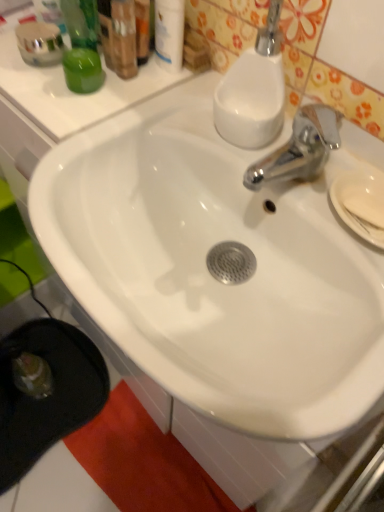
Where is `white glossy lotion at upper center`? This screenshot has width=384, height=512. white glossy lotion at upper center is located at coordinates (169, 34).

The width and height of the screenshot is (384, 512). What do you see at coordinates (83, 70) in the screenshot? I see `green matte jar at upper left` at bounding box center [83, 70].

I want to click on white glossy lotion at upper center, so click(169, 34).

Is red cotton beach towel at lower left beside white glossy soap dispenser at upper right?

They are not placed beside each other.

In terms of height, does red cotton beach towel at lower left look taller or shorter compared to white glossy soap dispenser at upper right?

In the image, red cotton beach towel at lower left appears to be shorter than white glossy soap dispenser at upper right.

Considering the sizes of red cotton beach towel at lower left and white glossy soap dispenser at upper right in the image, is red cotton beach towel at lower left wider or thinner than white glossy soap dispenser at upper right?

red cotton beach towel at lower left is wider than white glossy soap dispenser at upper right.

Find the location of `soap dispenser above the green matte jar at upper left (from a real-world perspective)`. soap dispenser above the green matte jar at upper left (from a real-world perspective) is located at coordinates (253, 90).

Is white glossy soap dispenser at upper right oriented towards green matte jar at upper left?

No, white glossy soap dispenser at upper right is not turned towards green matte jar at upper left.

In the image, is white glossy soap dispenser at upper right on the left side or the right side of green matte jar at upper left?

Based on their positions, white glossy soap dispenser at upper right is located to the right of green matte jar at upper left.

Based on the photo, which is less distant, (x=242, y=88) or (x=97, y=74)?

Point (x=242, y=88).

Is red cotton beach towel at lower left facing towards white glossy sink at center?

No, red cotton beach towel at lower left does not turn towards white glossy sink at center.

Does red cotton beach towel at lower left have a lesser width compared to white glossy sink at center?

Yes, red cotton beach towel at lower left is thinner than white glossy sink at center.

Considering the positions of objects red cotton beach towel at lower left and white glossy sink at center in the image provided, who is more to the right, red cotton beach towel at lower left or white glossy sink at center?

white glossy sink at center is more to the right.

Does white matte soap at right have a lesser width compared to red cotton beach towel at lower left?

Yes.

Is white matte soap at right next to red cotton beach towel at lower left and touching it?

No, white matte soap at right is not beside red cotton beach towel at lower left.

Consider the image. What's the angular difference between white matte soap at right and red cotton beach towel at lower left's facing directions?

The facing directions of white matte soap at right and red cotton beach towel at lower left are 3.73 degrees apart.

Is point (354, 208) farther from camera compared to point (162, 455)?

No, (354, 208) is closer to viewer.

Considering the sizes of objects white glossy sink at center and white glossy soap dispenser at upper right in the image provided, who is wider, white glossy sink at center or white glossy soap dispenser at upper right?

Wider between the two is white glossy sink at center.

Consider the image. In terms of height, does white glossy sink at center look taller or shorter compared to white glossy soap dispenser at upper right?

Considering their sizes, white glossy sink at center has more height than white glossy soap dispenser at upper right.

From a real-world perspective, is white glossy sink at center on white glossy soap dispenser at upper right?

No.

How different are the orientations of white glossy lotion at upper center and white matte soap at right in degrees?

The facing directions of white glossy lotion at upper center and white matte soap at right are 8.45 degrees apart.

From the image's perspective, which is below, white glossy lotion at upper center or white matte soap at right?

white matte soap at right, from the image's perspective.

Considering the relative positions of white glossy lotion at upper center and white matte soap at right in the image provided, is white glossy lotion at upper center in front of white matte soap at right?

No, white glossy lotion at upper center is further to the viewer.

Considering the relative sizes of white glossy lotion at upper center and red cotton beach towel at lower left in the image provided, is white glossy lotion at upper center wider than red cotton beach towel at lower left?

Incorrect, the width of white glossy lotion at upper center does not surpass that of red cotton beach towel at lower left.

Considering the sizes of objects white glossy lotion at upper center and red cotton beach towel at lower left in the image provided, who is bigger, white glossy lotion at upper center or red cotton beach towel at lower left?

red cotton beach towel at lower left is bigger.

Is white glossy lotion at upper center facing away from red cotton beach towel at lower left?

white glossy lotion at upper center is not turned away from red cotton beach towel at lower left.

Locate an element on the screen. beach towel below the white glossy lotion at upper center (from a real-world perspective) is located at coordinates (143, 462).

The image size is (384, 512). In order to click on soap dispenser above the red cotton beach towel at lower left (from a real-world perspective) in this screenshot , I will do `click(253, 90)`.

I want to click on soap dispenser below the green matte jar at upper left (from the image's perspective), so click(253, 90).

Based on their spatial positions, is green matte jar at upper left or white glossy lotion at upper center further from white matte soap at right?

green matte jar at upper left is positioned further to the anchor white matte soap at right.

Which object lies nearer to the anchor point red cotton beach towel at lower left, white matte soap at right or white glossy lotion at upper center?

white matte soap at right.

Looking at the image, which one is located closer to white glossy sink at center, white glossy lotion at upper center or green matte jar at upper left?

Among the two, green matte jar at upper left is located nearer to white glossy sink at center.

Looking at the image, which one is located closer to white glossy soap dispenser at upper right, white glossy lotion at upper center or white matte soap at right?

white glossy lotion at upper center is closer to white glossy soap dispenser at upper right.

From the image, which object appears to be nearer to red cotton beach towel at lower left, white glossy sink at center or white glossy soap dispenser at upper right?

The object closer to red cotton beach towel at lower left is white glossy sink at center.

Looking at the image, which one is located closer to white matte soap at right, white glossy lotion at upper center or white glossy sink at center?

white glossy sink at center lies closer to white matte soap at right than the other object.

Based on their spatial positions, is red cotton beach towel at lower left or white matte soap at right closer to white glossy lotion at upper center?

white matte soap at right lies closer to white glossy lotion at upper center than the other object.

Based on their spatial positions, is red cotton beach towel at lower left or green matte jar at upper left closer to white glossy lotion at upper center?

Based on the image, green matte jar at upper left appears to be nearer to white glossy lotion at upper center.

This screenshot has height=512, width=384. What are the coordinates of `toiletry between green matte jar at upper left and white matte soap at right` in the screenshot? It's located at (169, 34).

You are a GUI agent. You are given a task and a screenshot of the screen. Output one action in this format:
    pyautogui.click(x=<x>, y=<y>)
    Task: Click on the soap between white glossy lotion at upper center and white glossy sink at center vertically
    The height and width of the screenshot is (512, 384).
    Given the screenshot: What is the action you would take?
    pyautogui.click(x=365, y=203)

The height and width of the screenshot is (512, 384). What are the coordinates of `soap that lies between green matte jar at upper left and red cotton beach towel at lower left from top to bottom` in the screenshot? It's located at (365, 203).

Locate an element on the screen. The image size is (384, 512). soap dispenser between white glossy lotion at upper center and red cotton beach towel at lower left from top to bottom is located at coordinates (253, 90).